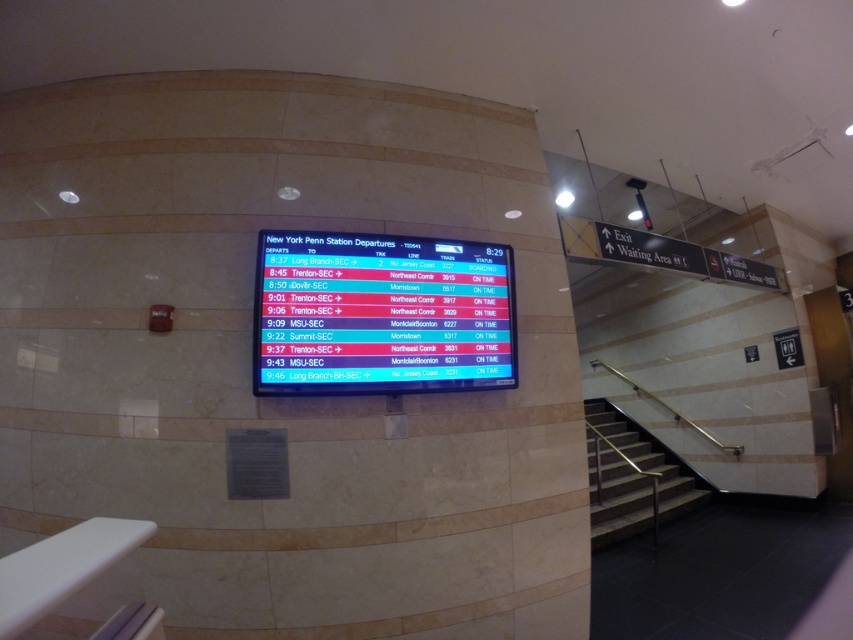
Question: Among these points, which one is farthest from the camera?

Choices:
 (A) (432, 275)
 (B) (641, 522)

Answer: (B)

Question: Does backlit lcd display at center appear on the left side of metallic silver handrail at lower right?

Choices:
 (A) no
 (B) yes

Answer: (B)

Question: Among these objects, which one is nearest to the camera?

Choices:
 (A) metallic silver handrail at lower right
 (B) backlit lcd display at center

Answer: (B)

Question: Is backlit lcd display at center smaller than metallic silver handrail at lower right?

Choices:
 (A) yes
 (B) no

Answer: (A)

Question: Does backlit lcd display at center appear on the left side of metallic silver handrail at lower right?

Choices:
 (A) yes
 (B) no

Answer: (A)